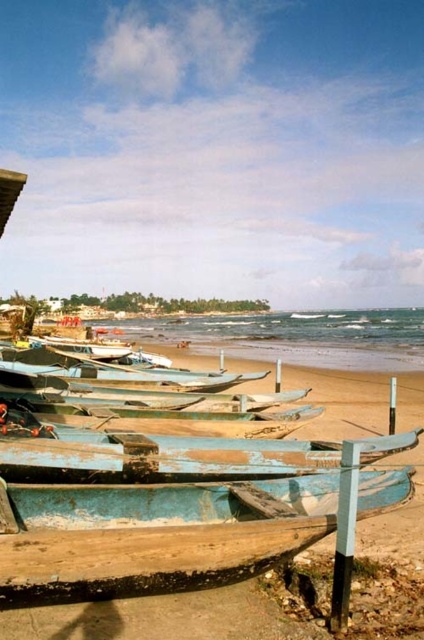
Measure the distance from blue wooden boats at lower center to blue weathered wood boat at lower center.

They are 6.51 meters apart.

The width and height of the screenshot is (424, 640). What do you see at coordinates (167, 572) in the screenshot?
I see `blue wooden boats at lower center` at bounding box center [167, 572].

Between point (357, 412) and point (189, 563), which one is positioned behind?

Point (357, 412)

Image resolution: width=424 pixels, height=640 pixels. What are the coordinates of `blue wooden boats at lower center` in the screenshot? It's located at (167, 572).

Where is `blue wooden boats at lower center`? Image resolution: width=424 pixels, height=640 pixels. blue wooden boats at lower center is located at coordinates (167, 572).

Who is shorter, blue wooden boats at lower center or blue weathered boat at lower center?

With less height is blue weathered boat at lower center.

Is point (398, 314) in front of point (236, 445)?

That is False.

Where is `blue wooden boats at lower center`? blue wooden boats at lower center is located at coordinates (167, 572).

Does blue weathered wood boat at lower center lie behind blue weathered boat at lower center?

No, it is not.

Between blue weathered wood boat at lower center and blue weathered boat at lower center, which one has less height?

Standing shorter between the two is blue weathered boat at lower center.

Which is in front, point (170, 499) or point (211, 458)?

Point (170, 499)

Find the location of a particular element. Image resolution: width=424 pixels, height=640 pixels. blue weathered wood boat at lower center is located at coordinates (153, 534).